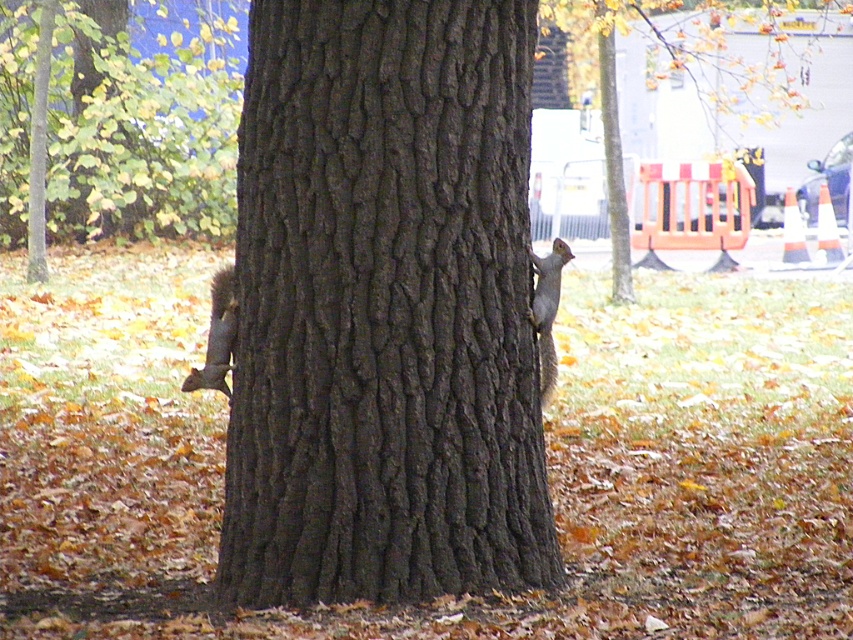
Question: Which object is closer to the camera taking this photo?

Choices:
 (A) gray fur squirrel at left
 (B) gray furry squirrel at right
 (C) brown rough bark at center

Answer: (C)

Question: Which object is closer to the camera taking this photo?

Choices:
 (A) gray fur squirrel at left
 (B) brown rough bark at center
 (C) gray furry squirrel at right

Answer: (B)

Question: From the image, what is the correct spatial relationship of gray fur squirrel at left in relation to gray furry squirrel at right?

Choices:
 (A) left
 (B) right

Answer: (A)

Question: Can you confirm if brown rough bark at center is wider than gray fur squirrel at left?

Choices:
 (A) yes
 (B) no

Answer: (A)

Question: Estimate the real-world distances between objects in this image. Which object is closer to the brown rough bark at center?

Choices:
 (A) gray fur squirrel at left
 (B) gray furry squirrel at right

Answer: (B)

Question: Is brown rough bark at center bigger than gray furry squirrel at right?

Choices:
 (A) yes
 (B) no

Answer: (A)